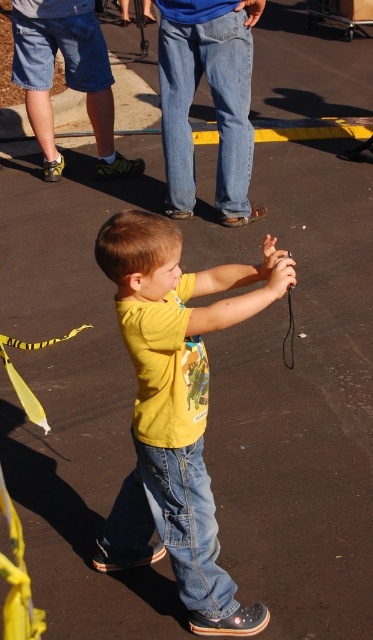
Who is more distant from viewer, (193, 529) or (10, 344)?

The point (10, 344) is more distant.

Is point (179, 528) behind point (4, 337)?

Yes, it is.

Image resolution: width=373 pixels, height=640 pixels. Identify the location of jeans at lower center. (182, 522).

Which is behind, point (227, 602) or point (177, 451)?

The point (227, 602) is more distant.

Does point (135, 260) come closer to viewer compared to point (148, 445)?

Yes, it is in front of point (148, 445).

Who is more distant from viewer, (267, 612) or (208, 476)?

The point (208, 476) is behind.

The image size is (373, 640). What are the coordinates of `yellow matte shirt at center` in the screenshot? It's located at (176, 410).

Is point (179, 209) positioned behind point (195, 515)?

That is True.

Locate an element on the screen. The image size is (373, 640). blue denim jeans at center is located at coordinates (214, 106).